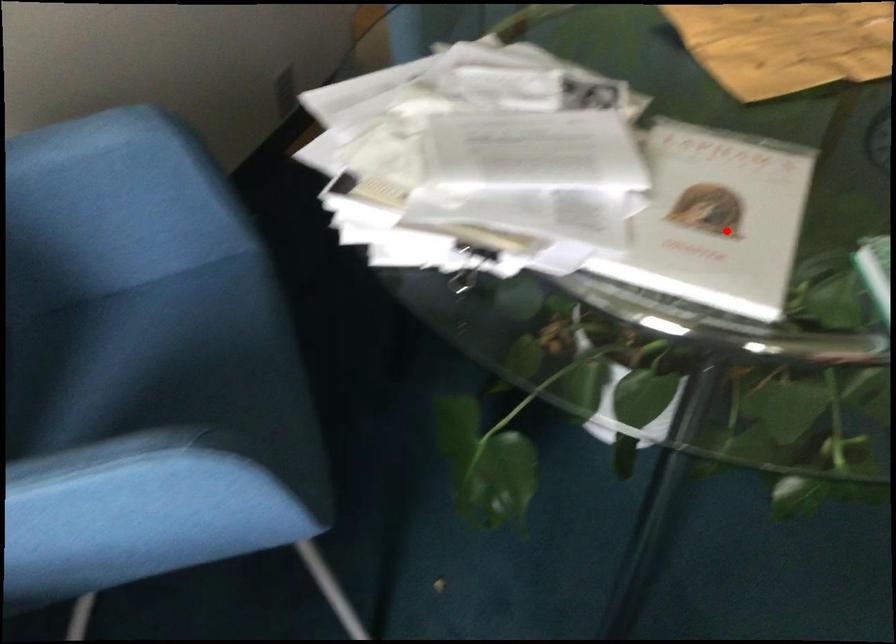
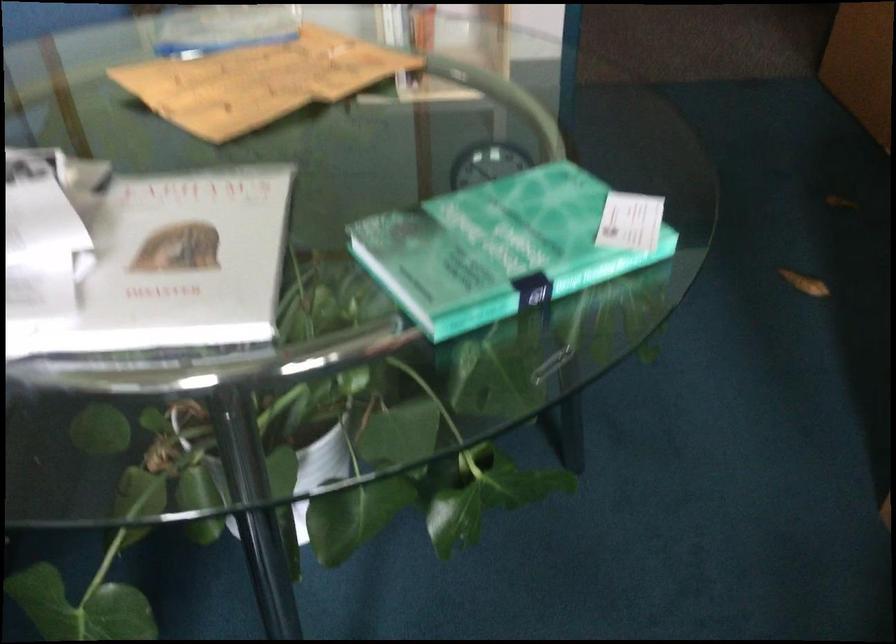
Question: I am providing you with two images of the same scene from different viewpoints. Given a red point in image1, look at the same physical point in image2. Is it:

Choices:
 (A) Closer to the viewpoint
 (B) Farther from the viewpoint

Answer: (A)